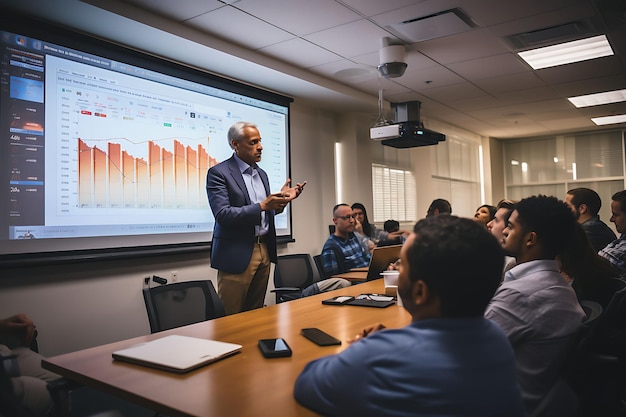
Where is `white board screen`? The width and height of the screenshot is (626, 417). white board screen is located at coordinates (52, 74), (84, 209), (85, 140), (156, 97), (141, 214), (183, 137), (285, 129), (203, 219).